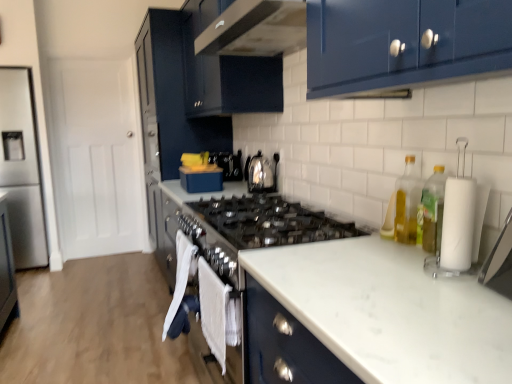
The height and width of the screenshot is (384, 512). What are the coordinates of `free spot to the left of white matte paper towel at right` in the screenshot? It's located at click(x=396, y=257).